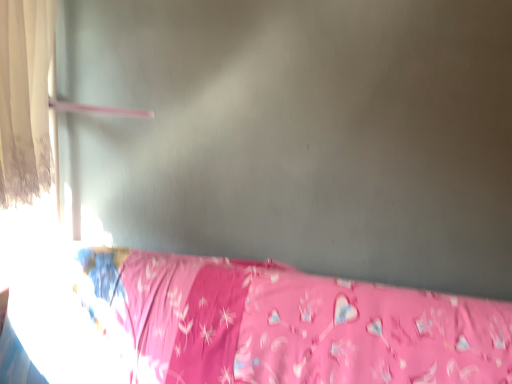
Question: From the image's perspective, is white sheer curtain at left located above pink fabric bed at lower right?

Choices:
 (A) yes
 (B) no

Answer: (A)

Question: Can you confirm if white sheer curtain at left is shorter than pink fabric bed at lower right?

Choices:
 (A) yes
 (B) no

Answer: (B)

Question: From a real-world perspective, is white sheer curtain at left on top of pink fabric bed at lower right?

Choices:
 (A) yes
 (B) no

Answer: (A)

Question: Does white sheer curtain at left come in front of pink fabric bed at lower right?

Choices:
 (A) no
 (B) yes

Answer: (A)

Question: Considering the relative positions of white sheer curtain at left and pink fabric bed at lower right in the image provided, is white sheer curtain at left to the right of pink fabric bed at lower right from the viewer's perspective?

Choices:
 (A) yes
 (B) no

Answer: (B)

Question: Does white sheer curtain at left turn towards pink fabric bed at lower right?

Choices:
 (A) no
 (B) yes

Answer: (A)

Question: Is pink fabric bed at lower right taller than white sheer curtain at left?

Choices:
 (A) yes
 (B) no

Answer: (B)

Question: Is white sheer curtain at left at the back of pink fabric bed at lower right?

Choices:
 (A) yes
 (B) no

Answer: (B)

Question: From a real-world perspective, is pink fabric bed at lower right positioned over white sheer curtain at left based on gravity?

Choices:
 (A) yes
 (B) no

Answer: (B)

Question: Can you confirm if pink fabric bed at lower right is thinner than white sheer curtain at left?

Choices:
 (A) no
 (B) yes

Answer: (A)

Question: Is pink fabric bed at lower right far away from white sheer curtain at left?

Choices:
 (A) no
 (B) yes

Answer: (A)

Question: Is the depth of pink fabric bed at lower right less than that of white sheer curtain at left?

Choices:
 (A) no
 (B) yes

Answer: (B)

Question: Is point (294, 380) closer or farther from the camera than point (10, 31)?

Choices:
 (A) farther
 (B) closer

Answer: (A)